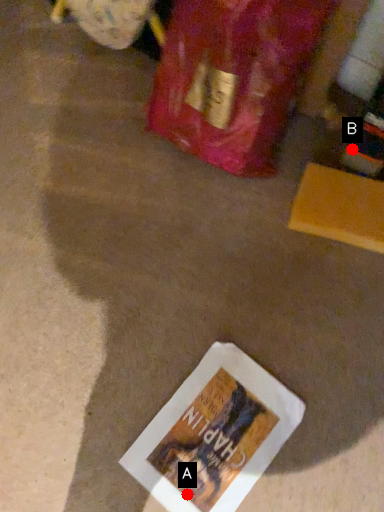
Question: Two points are circled on the image, labeled by A and B beside each circle. Which point is farther to the camera?

Choices:
 (A) A is further
 (B) B is further

Answer: (B)